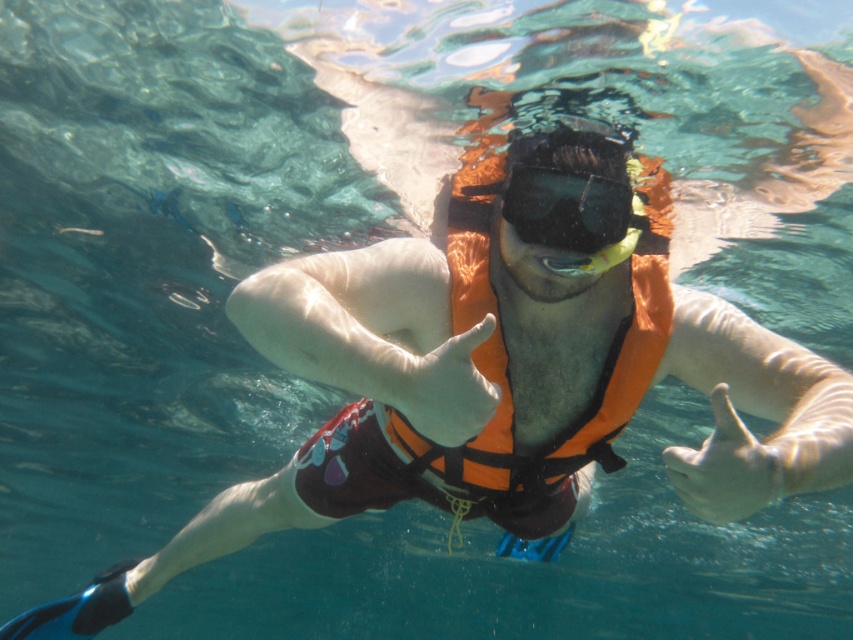
Between orange fabric life jacket at center and black matte snorkel mask at center, which one is positioned lower?

orange fabric life jacket at center is lower down.

In the scene shown: Who is more forward, (511, 435) or (572, 177)?

Positioned in front is point (572, 177).

At what (x,y) coordinates should I click in order to perform the action: click on orange fabric life jacket at center. Please return your answer as a coordinate pair (x, y). The image size is (853, 640). Looking at the image, I should click on (503, 337).